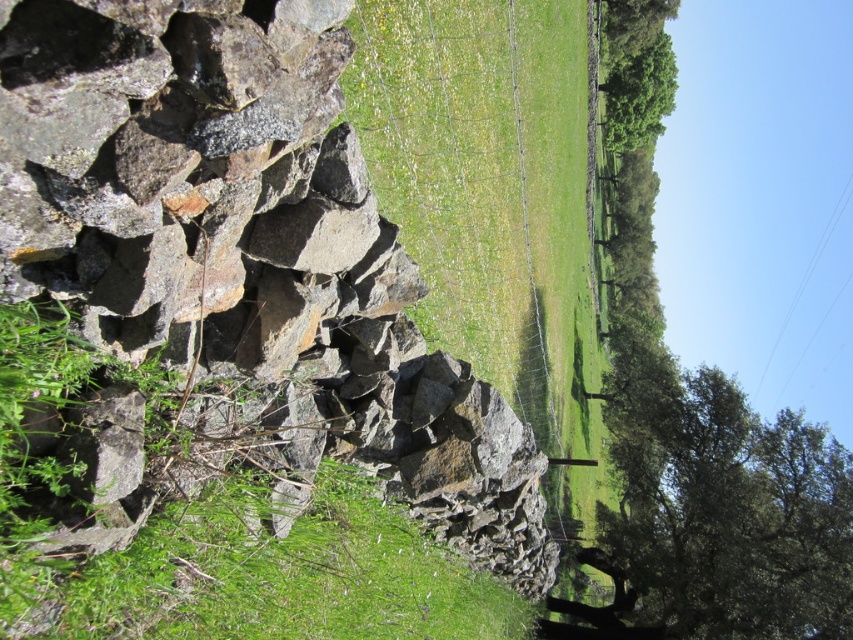
Question: Which object is the farthest from the rusty stone wall at left?

Choices:
 (A) green leafy tree at upper right
 (B) green grassy field at center

Answer: (A)

Question: Considering the real-world distances, which object is closest to the clear blue wires at upper right?

Choices:
 (A) rusty stone wall at left
 (B) green leafy tree at upper right
 (C) green leafy tree at right

Answer: (B)

Question: Does green leafy tree at right appear under green leafy tree at upper right?

Choices:
 (A) no
 (B) yes

Answer: (B)

Question: Is green leafy tree at right to the left of clear blue wires at upper right from the viewer's perspective?

Choices:
 (A) no
 (B) yes

Answer: (B)

Question: Which point is closer to the camera?

Choices:
 (A) (175, 221)
 (B) (640, 67)
 (C) (819, 237)

Answer: (A)

Question: Where is rusty stone wall at left located in relation to green leafy tree at right in the image?

Choices:
 (A) right
 (B) left

Answer: (B)